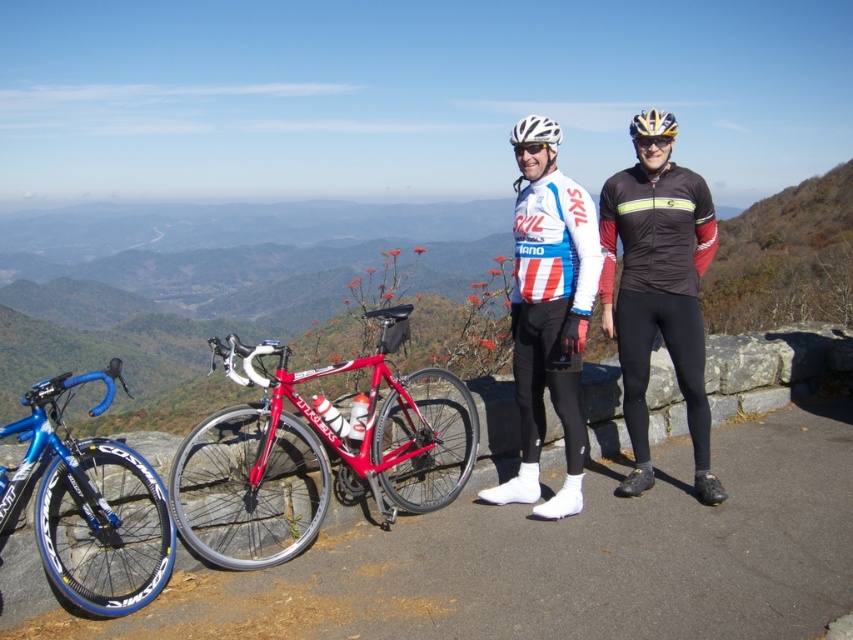
Does shiny red bike at center have a lesser width compared to white matte helmet at center?

Correct, shiny red bike at center's width is less than white matte helmet at center's.

Is point (407, 492) more distant than point (529, 138)?

Yes, it is behind point (529, 138).

The height and width of the screenshot is (640, 853). In order to click on shiny red bike at center in this screenshot , I will do `click(317, 452)`.

From the picture: Is black jersey at center further to camera compared to shiny blue bike at left?

That is True.

Does black jersey at center have a lesser width compared to shiny blue bike at left?

Incorrect, black jersey at center's width is not less than shiny blue bike at left's.

Where is `black jersey at center`? This screenshot has width=853, height=640. black jersey at center is located at coordinates (659, 296).

Between shiny red bike at center and white jersey at center, which one appears on the right side from the viewer's perspective?

white jersey at center is more to the right.

Image resolution: width=853 pixels, height=640 pixels. In order to click on shiny red bike at center in this screenshot , I will do `click(317, 452)`.